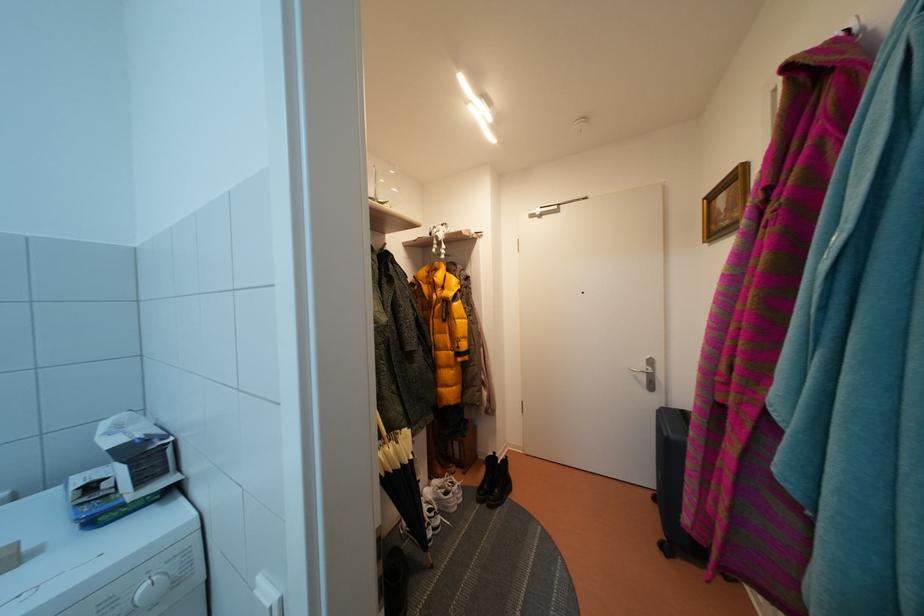
At what (x,y) coordinates should I click in order to perform the action: click on silver door handle. Please return your answer as a coordinate pair (x, y). Image resolution: width=924 pixels, height=616 pixels. Looking at the image, I should click on (647, 368).